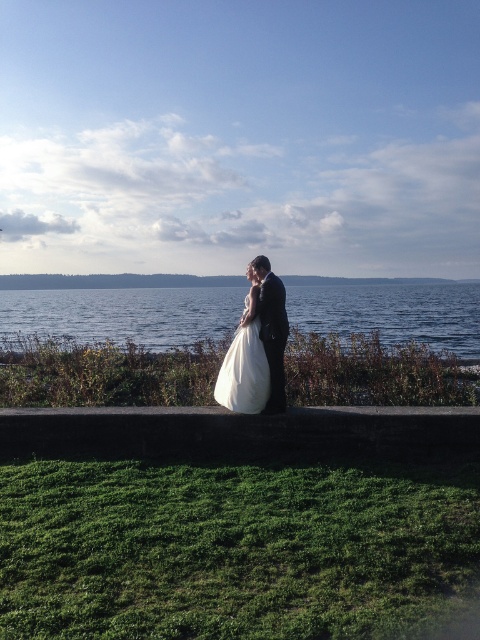
You are standing at the point with coordinates point (x=251, y=403) and want to walk towards the point (x=420, y=406). Which direction should you move to get closer to your destination?

Since point (x=420, y=406) is further to the viewer than point (x=251, y=403), you should move forward towards the direction of the couple to reach your destination.

You are a photographer taking a picture of the scene. You notice two points marked in the image. The first point is at coordinate point (145, 417) and the second is at point (268, 406). Which point is closer to your camera?

Point (268, 406) is closer to the camera because the description states that point (145, 417) is further away than point (268, 406).

You are a photographer positioned behind the couple to capture their embrace. You need to ensure the dark gray concrete ledge at center does not block the view of the satin black suit at center in your photo. Based on their heights, will the ledge be visible behind the couple?

The dark gray concrete ledge at center is not as tall as the satin black suit at center, so the ledge will not block the view of the suit in the photo.